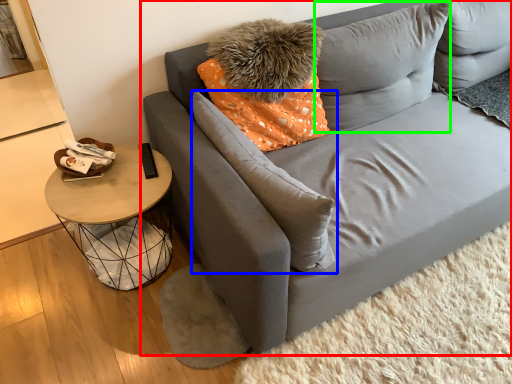
Question: Estimate the real-world distances between objects in this image. Which object is closer to studio couch (highlighted by a red box), pillow (highlighted by a blue box) or pillow (highlighted by a green box)?

Choices:
 (A) pillow
 (B) pillow

Answer: (B)